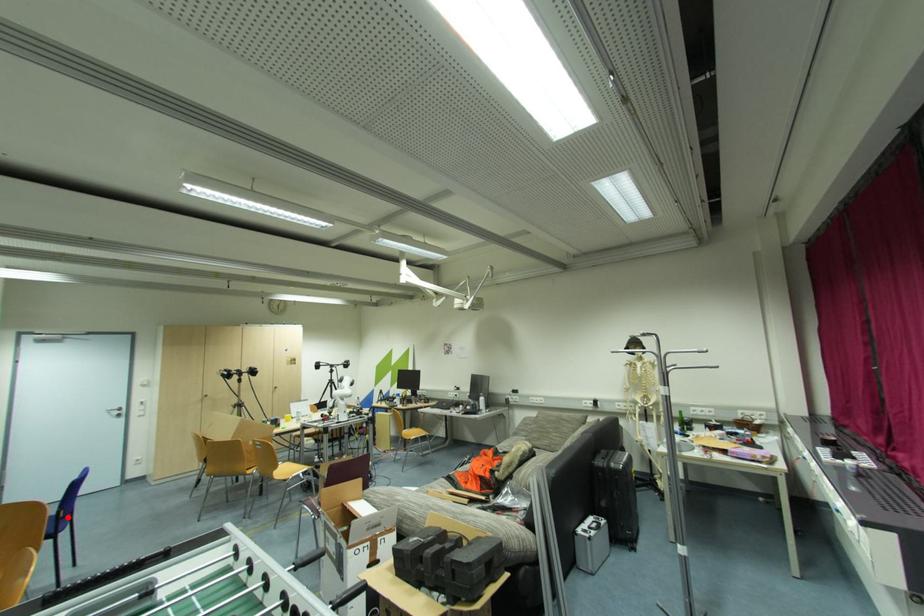
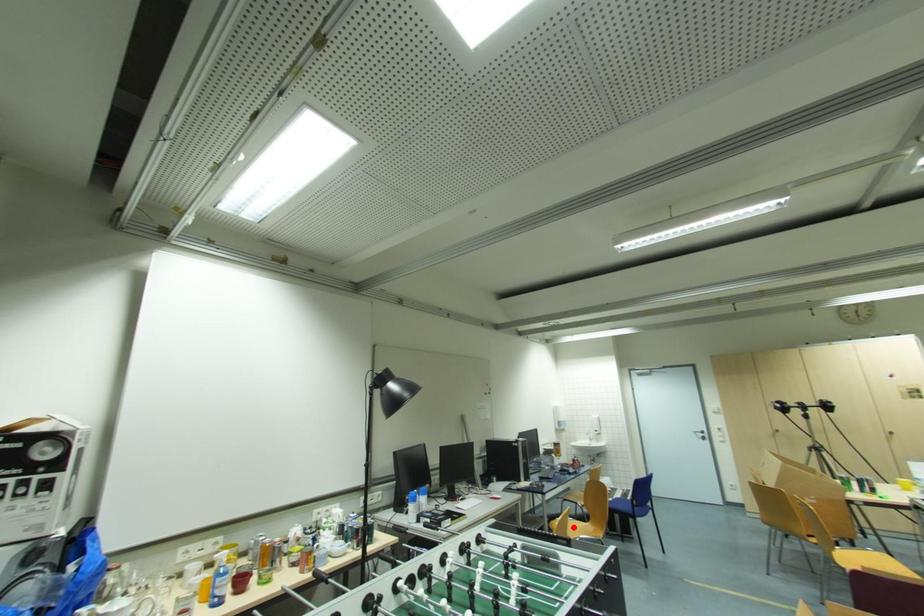
I am providing you with two images of the same scene from different viewpoints. A red point is marked on the first image and another point is marked on the second image. Is the red point in image1 aligned with the point shown in image2?

No